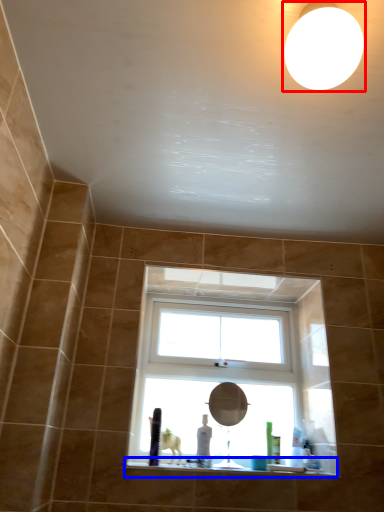
Question: Which object is closer to the camera taking this photo, lighting (highlighted by a red box) or window sill (highlighted by a blue box)?

Choices:
 (A) lighting
 (B) window sill

Answer: (A)